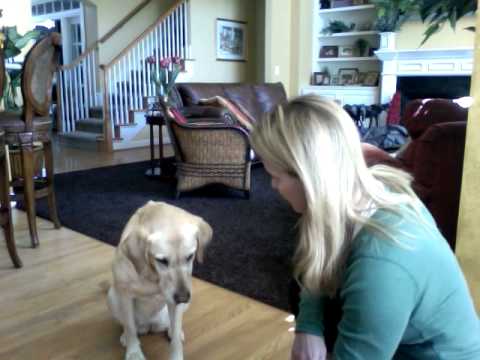
Find the location of `picture frames`. picture frames is located at coordinates (330, 50), (351, 52), (318, 76), (344, 75), (368, 79), (359, 77), (336, 79), (364, 24), (357, 3), (238, 44).